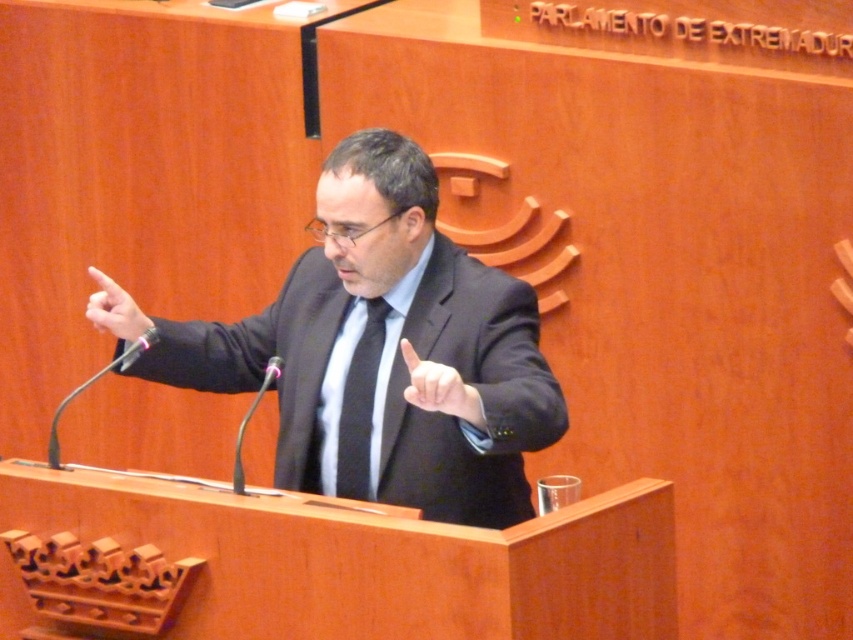
Is matte black suit at center above black silk tie at center?

Indeed, matte black suit at center is positioned over black silk tie at center.

Is matte black suit at center smaller than black silk tie at center?

Incorrect, matte black suit at center is not smaller in size than black silk tie at center.

Describe the element at coordinates (380, 352) in the screenshot. This screenshot has width=853, height=640. I see `matte black suit at center` at that location.

Where is `matte black suit at center`? Image resolution: width=853 pixels, height=640 pixels. matte black suit at center is located at coordinates (380, 352).